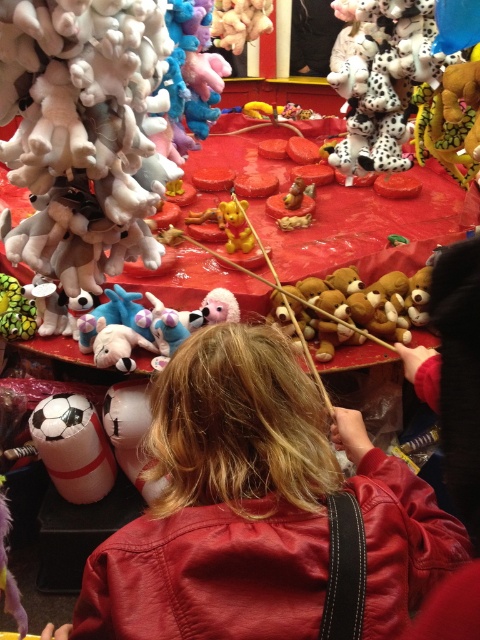
Who is taller, leather jacket at center or soft plush teddy bear at center?

A: Standing taller between the two is leather jacket at center.

What do you see at coordinates (256, 508) in the screenshot? I see `leather jacket at center` at bounding box center [256, 508].

Is point (127, 609) positioned behind point (325, 330)?

No, (127, 609) is closer to viewer.

Locate an element on the screen. leather jacket at center is located at coordinates coord(256,508).

Is leather jacket at center shorter than soft plush bear at center?

In fact, leather jacket at center may be taller than soft plush bear at center.

Locate an element on the screen. The image size is (480, 640). leather jacket at center is located at coordinates (256, 508).

Does soft plush teddy bear at center have a larger size compared to green fuzzy plush at left?

Yes, soft plush teddy bear at center is bigger than green fuzzy plush at left.

Who is more distant from viewer, (332,324) or (24,328)?

The point (24,328) is more distant.

Locate an element on the screen. The height and width of the screenshot is (640, 480). soft plush teddy bear at center is located at coordinates (370, 304).